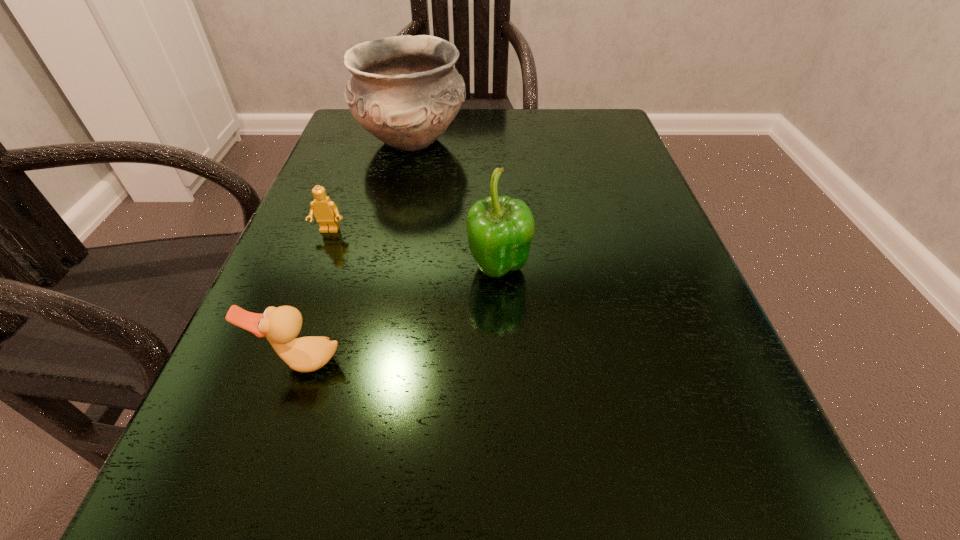
You are a GUI agent. You are given a task and a screenshot of the screen. Output one action in this format:
    pyautogui.click(x=<x>, y=<y>)
    Task: Click on the pottery
    This screenshot has height=540, width=960.
    Given the screenshot: What is the action you would take?
    pyautogui.click(x=404, y=90)

At what (x,y) coordinates should I click in order to perform the action: click on the second tallest object. Please return your answer as a coordinate pair (x, y). The image size is (960, 540). Looking at the image, I should click on (500, 229).

The height and width of the screenshot is (540, 960). What are the coordinates of `bell pepper` in the screenshot? It's located at (500, 229).

This screenshot has width=960, height=540. What are the coordinates of `duck` in the screenshot? It's located at (281, 325).

At what (x,y) coordinates should I click in order to perform the action: click on the second farthest object. Please return your answer as a coordinate pair (x, y). Looking at the image, I should click on (325, 211).

Locate an element on the screen. the shortest object is located at coordinates (x=325, y=211).

I want to click on vacant space located on the front of the pottery, so click(x=378, y=294).

Where is `vacant space located on the left of the rightmost object`? The height and width of the screenshot is (540, 960). vacant space located on the left of the rightmost object is located at coordinates [403, 269].

You are a GUI agent. You are given a task and a screenshot of the screen. Output one action in this format:
    pyautogui.click(x=<x>, y=<y>)
    Task: Click on the vacant space situated 0.120m on the beak of the duck
    This screenshot has width=960, height=540.
    Given the screenshot: What is the action you would take?
    pyautogui.click(x=262, y=477)

What are the coordinates of `blank space located 0.120m on the face of the shortest object` in the screenshot? It's located at pos(308,287).